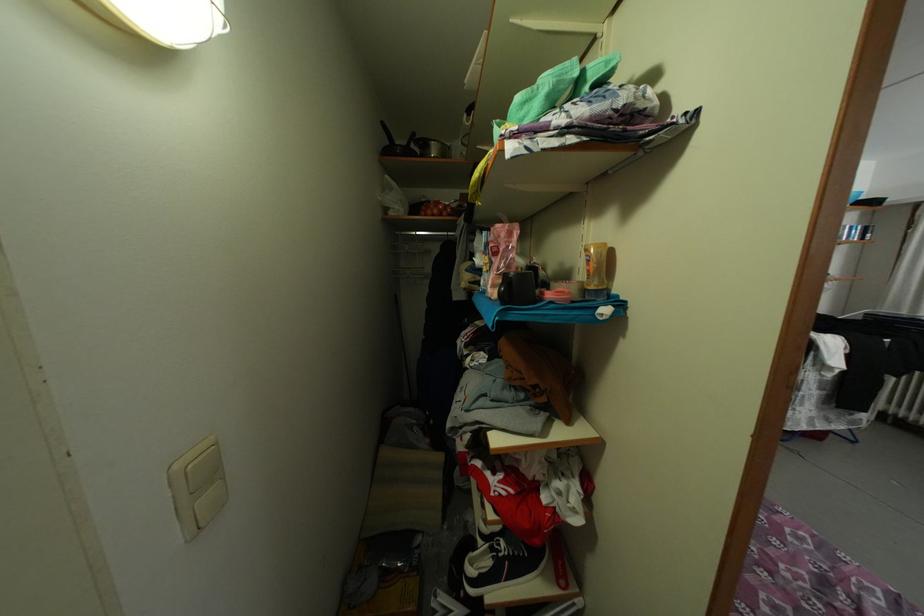
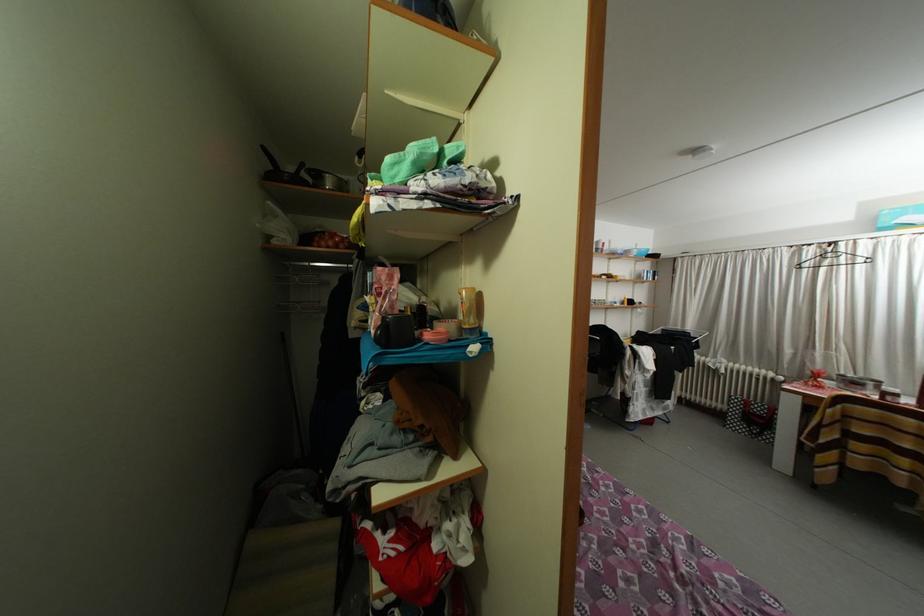
Question: The camera is either moving clockwise (left) or counter-clockwise (right) around the object. The first image is from the beginning of the video and the second image is from the end. Is the camera moving left or right when shooting the video?

Choices:
 (A) Left
 (B) Right

Answer: (A)